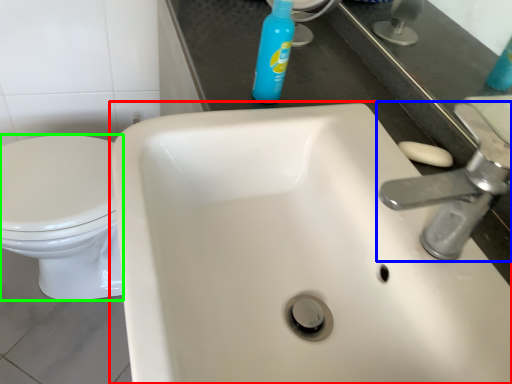
Question: Which object is the closest to the sink (highlighted by a red box)? Choose among these: tap (highlighted by a blue box) or bidet (highlighted by a green box).

Choices:
 (A) tap
 (B) bidet

Answer: (A)